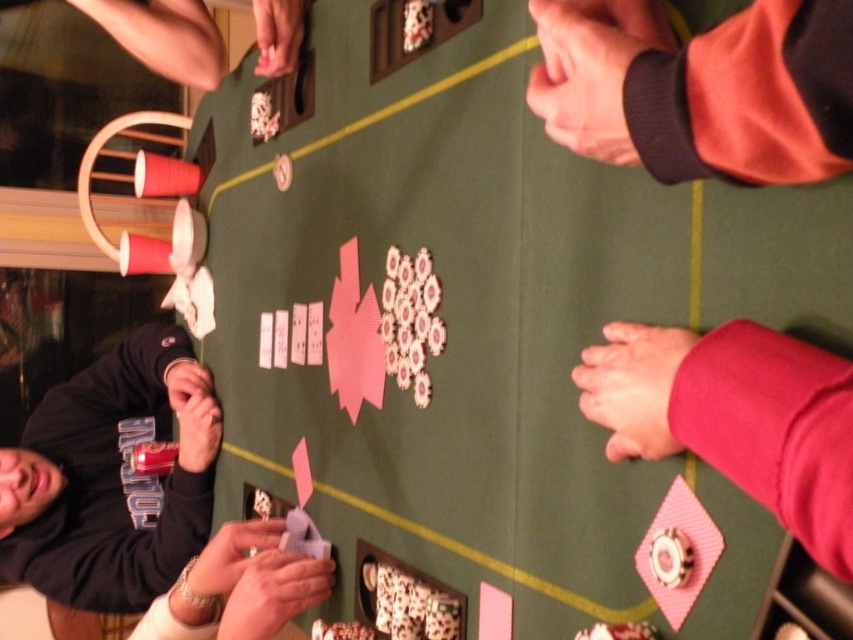
Question: Can you confirm if pink fabric hand at lower right is positioned below smooth gray cards at lower center?

Choices:
 (A) yes
 (B) no

Answer: (B)

Question: Which point is farther to the camera?

Choices:
 (A) (204, 634)
 (B) (849, 547)
 (C) (4, 499)

Answer: (C)

Question: Is the position of black fabric shirt at lower left less distant than that of smooth gray cards at lower center?

Choices:
 (A) yes
 (B) no

Answer: (B)

Question: Estimate the real-world distances between objects in this image. Which object is closer to the pink fabric hand at lower right?

Choices:
 (A) smooth gray cards at lower center
 (B) black fabric shirt at lower left

Answer: (A)

Question: Which object is positioned closest to the black fabric shirt at lower left?

Choices:
 (A) pink fabric hand at lower right
 (B) smooth gray cards at lower center

Answer: (B)

Question: Can you confirm if black fabric shirt at lower left is positioned to the right of pink fabric hand at lower right?

Choices:
 (A) no
 (B) yes

Answer: (A)